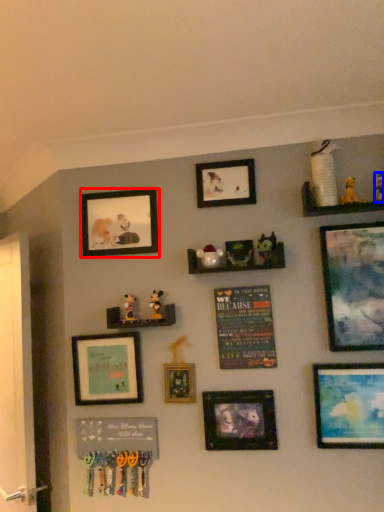
Question: Which point is further to the camera, picture frame (highlighted by a red box) or toy (highlighted by a blue box)?

Choices:
 (A) picture frame
 (B) toy

Answer: (A)